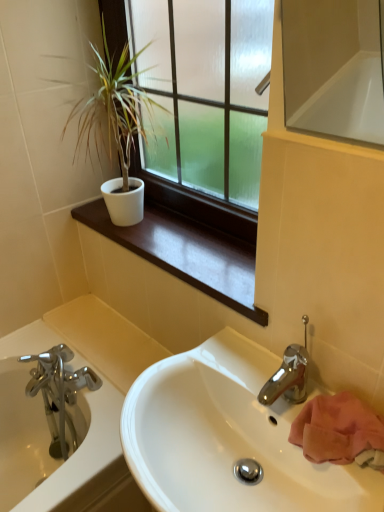
Question: Can you confirm if matte glass window at upper center is positioned to the left of white matte window sill at upper center?

Choices:
 (A) yes
 (B) no

Answer: (A)

Question: Can you confirm if matte glass window at upper center is thinner than white matte window sill at upper center?

Choices:
 (A) no
 (B) yes

Answer: (B)

Question: Is the position of matte glass window at upper center more distant than that of white matte window sill at upper center?

Choices:
 (A) no
 (B) yes

Answer: (A)

Question: Can we say matte glass window at upper center lies outside white matte window sill at upper center?

Choices:
 (A) no
 (B) yes

Answer: (B)

Question: Is matte glass window at upper center far away from white matte window sill at upper center?

Choices:
 (A) no
 (B) yes

Answer: (A)

Question: In terms of width, does white matte window sill at upper center look wider or thinner when compared to matte glass window at upper center?

Choices:
 (A) thin
 (B) wide

Answer: (B)

Question: Is white matte window sill at upper center taller or shorter than matte glass window at upper center?

Choices:
 (A) short
 (B) tall

Answer: (A)

Question: In terms of size, does white matte window sill at upper center appear bigger or smaller than matte glass window at upper center?

Choices:
 (A) small
 (B) big

Answer: (A)

Question: From a real-world perspective, is white matte window sill at upper center positioned above or below matte glass window at upper center?

Choices:
 (A) above
 (B) below

Answer: (B)

Question: Considering their positions, is white matte pot at upper left located in front of or behind white matte window sill at upper center?

Choices:
 (A) front
 (B) behind

Answer: (A)

Question: Is white matte pot at upper left taller or shorter than white matte window sill at upper center?

Choices:
 (A) tall
 (B) short

Answer: (A)

Question: Is white matte pot at upper left inside or outside of white matte window sill at upper center?

Choices:
 (A) outside
 (B) inside

Answer: (A)

Question: Based on their sizes in the image, would you say white matte pot at upper left is bigger or smaller than white matte window sill at upper center?

Choices:
 (A) small
 (B) big

Answer: (B)

Question: Is matte glass window at upper center taller or shorter than white matte pot at upper left?

Choices:
 (A) tall
 (B) short

Answer: (A)

Question: From a real-world perspective, relative to white matte pot at upper left, is matte glass window at upper center vertically above or below?

Choices:
 (A) below
 (B) above

Answer: (B)